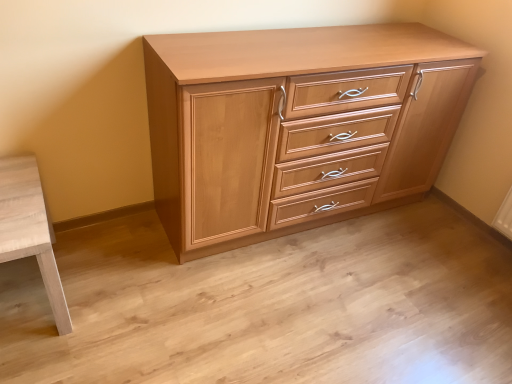
What do you see at coordinates (297, 126) in the screenshot?
I see `light wood chest of drawers at center` at bounding box center [297, 126].

Where is `light wood chest of drawers at center`? Image resolution: width=512 pixels, height=384 pixels. light wood chest of drawers at center is located at coordinates (297, 126).

The height and width of the screenshot is (384, 512). Find the location of `light wood table at lower left`. light wood table at lower left is located at coordinates (30, 229).

In order to face light wood table at lower left, should I rotate leftwards or rightwards?

To align with it, rotate left about 29.045°.

The image size is (512, 384). What do you see at coordinates (30, 229) in the screenshot? I see `light wood table at lower left` at bounding box center [30, 229].

Image resolution: width=512 pixels, height=384 pixels. What are the coordinates of `light wood chest of drawers at center` in the screenshot? It's located at (297, 126).

Considering the relative positions of light wood table at lower left and light wood chest of drawers at center in the image provided, is light wood table at lower left to the right of light wood chest of drawers at center from the viewer's perspective?

In fact, light wood table at lower left is to the left of light wood chest of drawers at center.

Between light wood table at lower left and light wood chest of drawers at center, which one is positioned behind?

light wood chest of drawers at center is behind.

Does point (30, 192) appear closer or farther from the camera than point (389, 192)?

Point (30, 192).

From the image's perspective, is light wood table at lower left on light wood chest of drawers at center?

No, from the image's perspective, light wood table at lower left is not over light wood chest of drawers at center.

From a real-world perspective, which is physically below, light wood table at lower left or light wood chest of drawers at center?

light wood table at lower left, from a real-world perspective.

Can you confirm if light wood table at lower left is thinner than light wood chest of drawers at center?

No.

Between light wood table at lower left and light wood chest of drawers at center, which one has more height?

light wood chest of drawers at center.

Based on their sizes in the image, would you say light wood table at lower left is bigger or smaller than light wood chest of drawers at center?

Considering their sizes, light wood table at lower left takes up less space than light wood chest of drawers at center.

Is light wood table at lower left located outside light wood chest of drawers at center?

Yes, light wood table at lower left is not within light wood chest of drawers at center.

Are light wood table at lower left and light wood chest of drawers at center beside each other?

No, light wood table at lower left is not with light wood chest of drawers at center.

Is light wood table at lower left looking in the opposite direction of light wood chest of drawers at center?

light wood table at lower left does not have its back to light wood chest of drawers at center.

Can you tell me how much light wood table at lower left and light wood chest of drawers at center differ in facing direction?

0.239 degrees.

Locate an element on the screen. the chest of drawers that appears behind the light wood table at lower left is located at coordinates (297, 126).

Between light wood chest of drawers at center and light wood table at lower left, which one appears on the left side from the viewer's perspective?

Positioned to the left is light wood table at lower left.

Between light wood chest of drawers at center and light wood table at lower left, which one is positioned in front?

light wood table at lower left is in front.

Which is farther, (424, 98) or (14, 239)?

Positioned behind is point (424, 98).

From the image's perspective, does light wood chest of drawers at center appear lower than light wood table at lower left?

No, from the image's perspective, light wood chest of drawers at center is not below light wood table at lower left.

From a real-world perspective, who is located higher, light wood chest of drawers at center or light wood table at lower left?

In real-world perspective, light wood chest of drawers at center is above.

Which object is wider, light wood chest of drawers at center or light wood table at lower left?

Wider between the two is light wood table at lower left.

Considering the relative sizes of light wood chest of drawers at center and light wood table at lower left in the image provided, is light wood chest of drawers at center shorter than light wood table at lower left?

No.

Based on their sizes in the image, would you say light wood chest of drawers at center is bigger or smaller than light wood table at lower left?

Considering their sizes, light wood chest of drawers at center takes up more space than light wood table at lower left.

Is light wood chest of drawers at center completely or partially outside of light wood table at lower left?

A: light wood chest of drawers at center is positioned outside light wood table at lower left.

Is light wood chest of drawers at center positioned far away from light wood table at lower left?

They are positioned close to each other.

Is light wood chest of drawers at center oriented towards light wood table at lower left?

No, light wood chest of drawers at center does not turn towards light wood table at lower left.

Can you tell me how much light wood chest of drawers at center and light wood table at lower left differ in facing direction?

The facing directions of light wood chest of drawers at center and light wood table at lower left are 0.239 degrees apart.

Measure the distance from light wood chest of drawers at center to light wood table at lower left.

light wood chest of drawers at center and light wood table at lower left are 36.89 inches apart.

Where is `the chest of drawers above the light wood table at lower left (from the image's perspective)`? The image size is (512, 384). the chest of drawers above the light wood table at lower left (from the image's perspective) is located at coordinates (297, 126).

Identify the location of table that appears below the light wood chest of drawers at center (from a real-world perspective). (30, 229).

Locate an element on the screen. chest of drawers on the right of the light wood table at lower left is located at coordinates (297, 126).